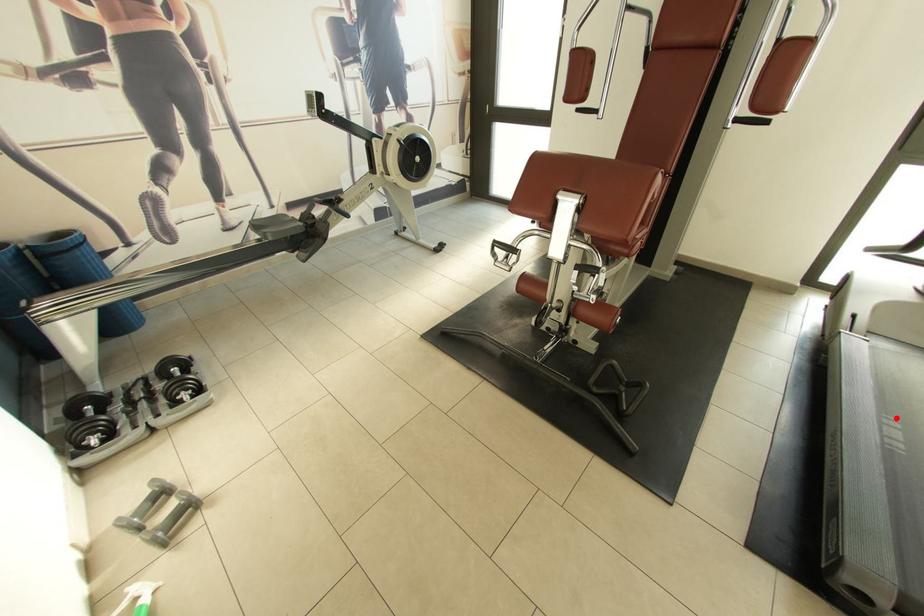
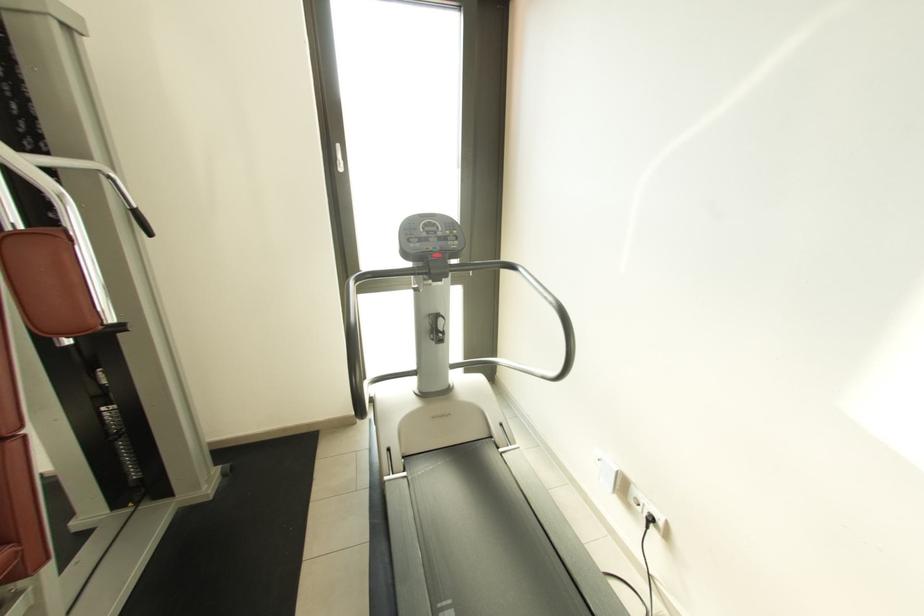
Where in the second image is the point corresponding to the highlighted location from the first image?

(450, 605)